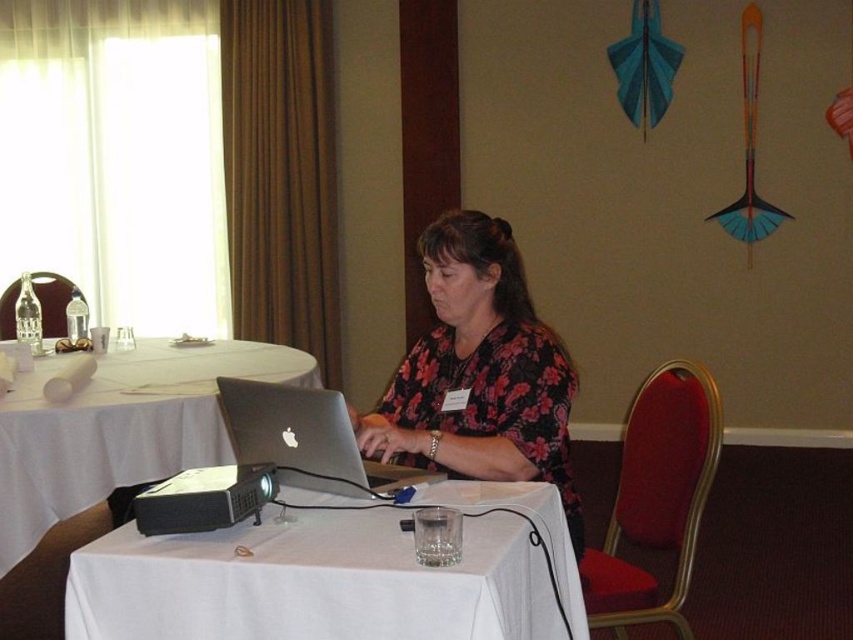
You are standing at the entrance of the conference room and see two points marked in the scene. The first point is at position point (468, 490) and the second is at point (33, 413). Which point is closer to you?

Point (468, 490) is in front of point (33, 413), so it is closer to you.